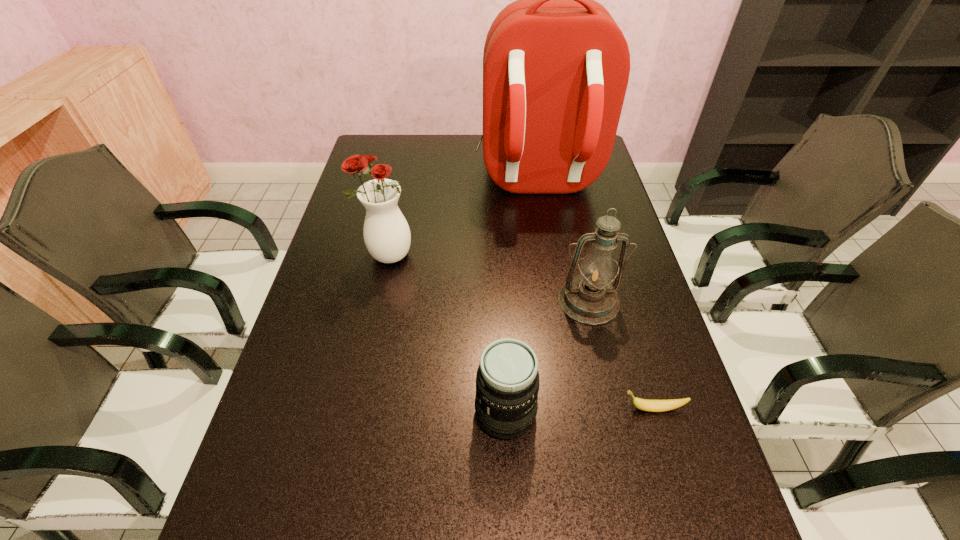
Locate an element on the screen. The height and width of the screenshot is (540, 960). vacant region between the third farthest object and the second shortest object is located at coordinates (547, 356).

Locate an element on the screen. The width and height of the screenshot is (960, 540). free space between the fourth nearest object and the tallest object is located at coordinates (463, 219).

In order to click on vacant area between the telephoto lens and the farthest object in this screenshot , I will do pyautogui.click(x=521, y=298).

Identify which object is the nearest to the oil lamp. Please provide its 2D coordinates. Your answer should be formatted as a tuple, i.e. [(x, y)], where the tuple contains the x and y coordinates of a point satisfying the conditions above.

[(507, 382)]

The image size is (960, 540). In order to click on object that is the second closest to the farthest object in this screenshot , I will do `click(590, 298)`.

Where is `free location that satisfies the following two spatial constraints: 1. on the strap side of the third nearest object; 2. on the left side of the farthest object`? free location that satisfies the following two spatial constraints: 1. on the strap side of the third nearest object; 2. on the left side of the farthest object is located at coordinates (556, 301).

Find the location of a particular element. free spot that satisfies the following two spatial constraints: 1. on the strap side of the third nearest object; 2. on the right side of the tallest object is located at coordinates (556, 301).